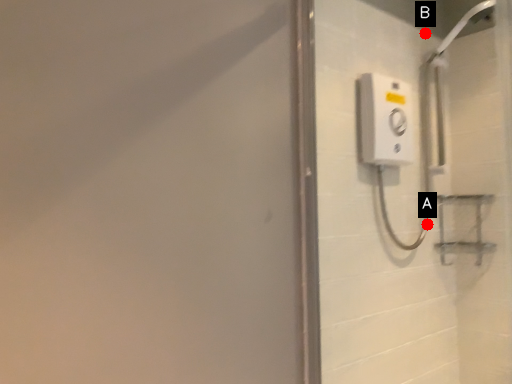
Question: Two points are circled on the image, labeled by A and B beside each circle. Which point appears farthest from the camera in this image?

Choices:
 (A) A is further
 (B) B is further

Answer: (B)